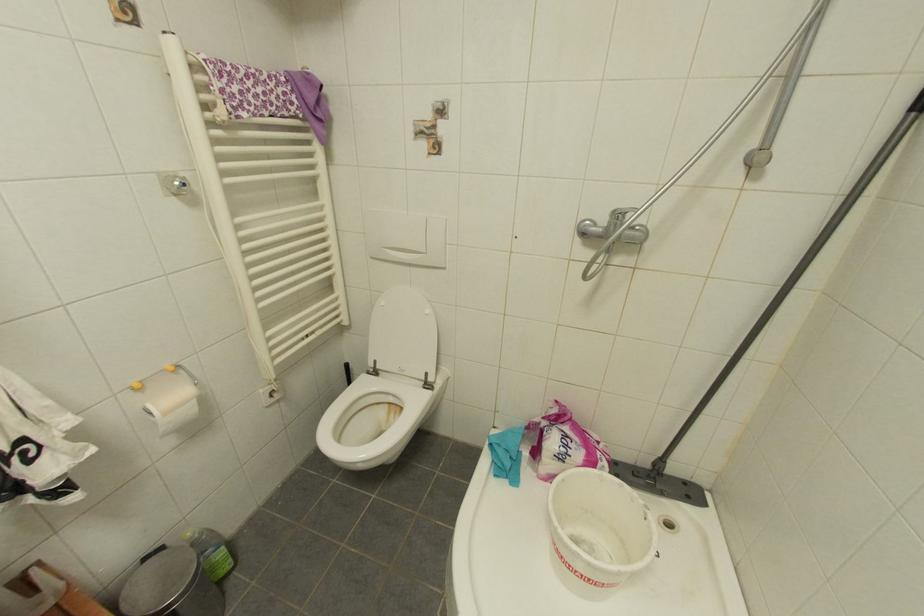
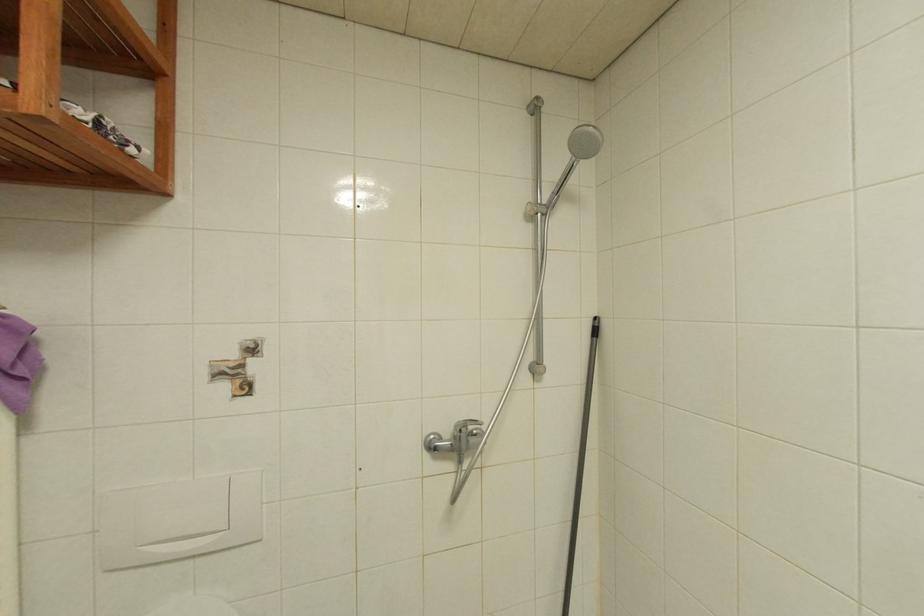
The images are taken continuously from a first-person perspective. In which direction is your viewpoint rotating?

The rotation direction of the camera is right-up.